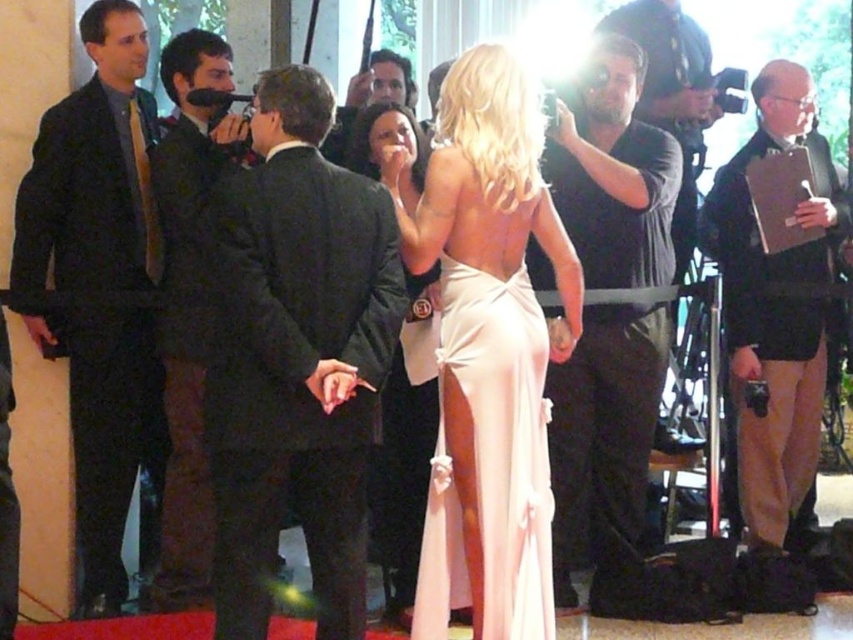
You are a photographer at the event and need to capture a photo that includes both the satin pink dress at center and the dark suit at left. Which of the two should you focus on first to ensure it appears larger in the photo?

The satin pink dress at center has a larger size compared to dark suit at left, so you should focus on the satin pink dress at center first to ensure it appears larger in the photo.